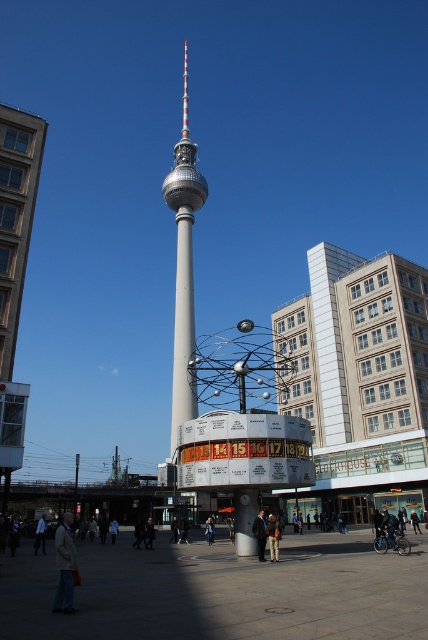
You are standing at a distance from the silver metallic tower at center. You want to take a photo of it using a camera. The recommended distance for capturing the entire tower in one frame is 300 feet. Is the current distance sufficient?

The silver metallic tower at center and camera are 343.88 feet apart from each other. Since 343.88 feet is greater than the recommended 300 feet, the current distance is sufficient to capture the entire tower in one frame.

You are standing at the base of the Fernsehturm in Berlin and want to take a photo of the two points mentioned. Which point, point (270,545) or point (171,525), will appear larger in your camera view?

Point (270,545) will appear larger in your camera view because it is closer to the camera than point (171,525).

You are standing in the bustling urban scene with the Fernsehturm in Berlin. You see a brown leather jacket at center. Where exactly is the brown leather jacket located in relation to the Fernsehturm?

The brown leather jacket at center is located at point coordinates of 0.839 on the x axis and 0.638 on the y axis, but since the scene is centered around the Fernsehturm, the jacket is positioned near the central area of the image, likely close to the tower.